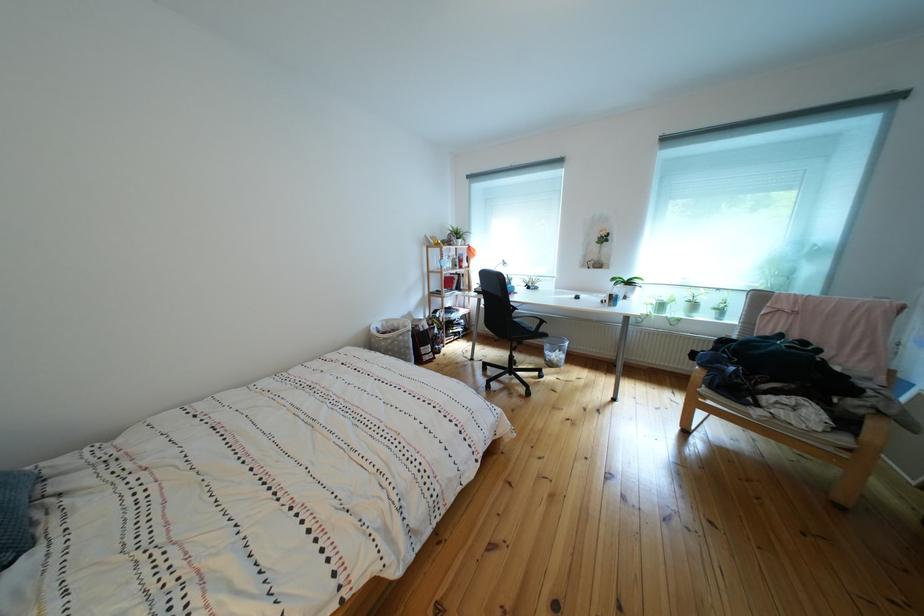
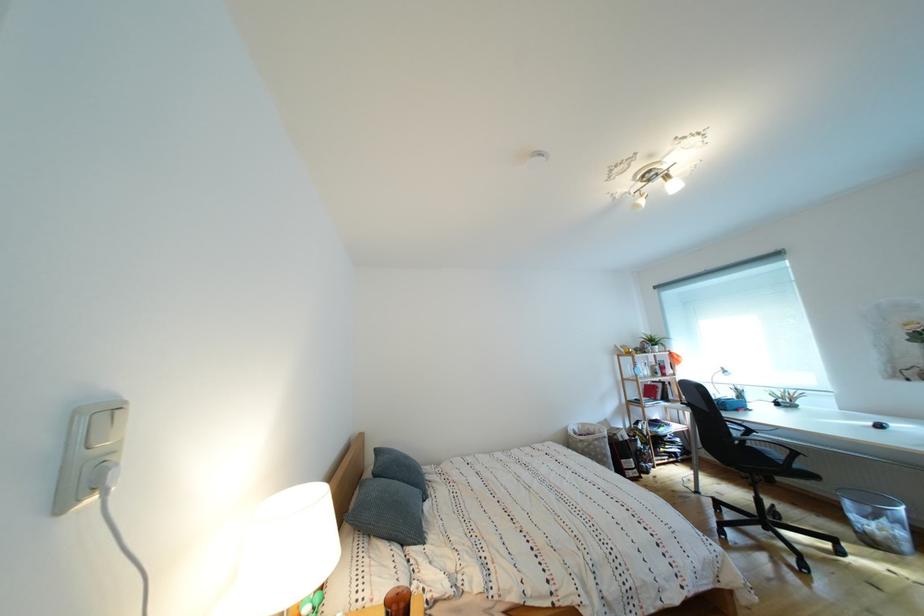
Where in the second image is the point corresponding to point (398, 326) from the first image?

(594, 430)